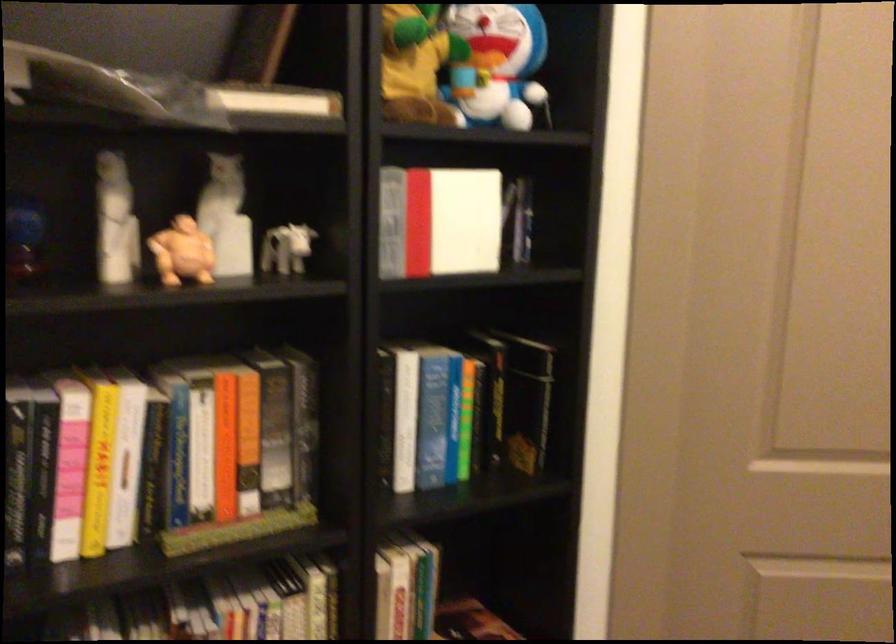
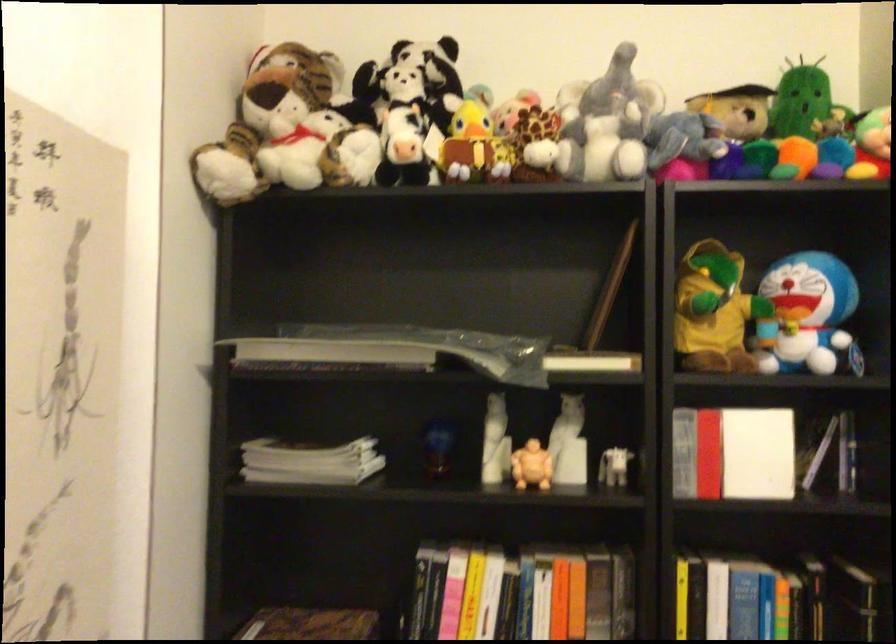
In the second image, find the point that corresponds to pixel 186 254 in the first image.

(531, 466)